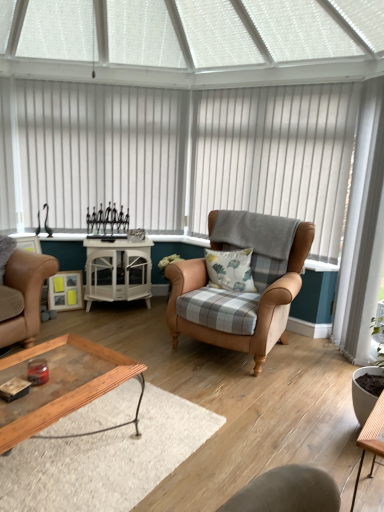
Question: Is wooden table at lower right, the 1th table positioned from the front, wider or thinner than white glossy cabinet at center, the 2th table positioned from the front?

Choices:
 (A) thin
 (B) wide

Answer: (A)

Question: Is wooden table at lower right, the second table in the top-to-bottom sequence, taller or shorter than white glossy cabinet at center, the 1th table positioned from the back?

Choices:
 (A) tall
 (B) short

Answer: (B)

Question: Estimate the real-world distances between objects in this image. Which object is closer to the fluffy cotton pillow at center?

Choices:
 (A) white glossy cabinet at center, the 1th table positioned from the back
 (B) wooden tray at lower center
 (C) wooden table at lower right, which appears as the first table when ordered from the bottom
 (D) white vertical blinds at center, positioned as the 2th blind in left-to-right order
 (E) white vertical blinds at upper center, the first blind when ordered from left to right

Answer: (D)

Question: Estimate the real-world distances between objects in this image. Which object is closer to the white glossy cabinet at center, the 2th table in the bottom-to-top sequence?

Choices:
 (A) wooden table at lower right, positioned as the 2th table in left-to-right order
 (B) leather armchair at center
 (C) white vertical blinds at upper center, the first blind when ordered from left to right
 (D) wooden tray at lower center
 (E) fluffy cotton pillow at center

Answer: (C)